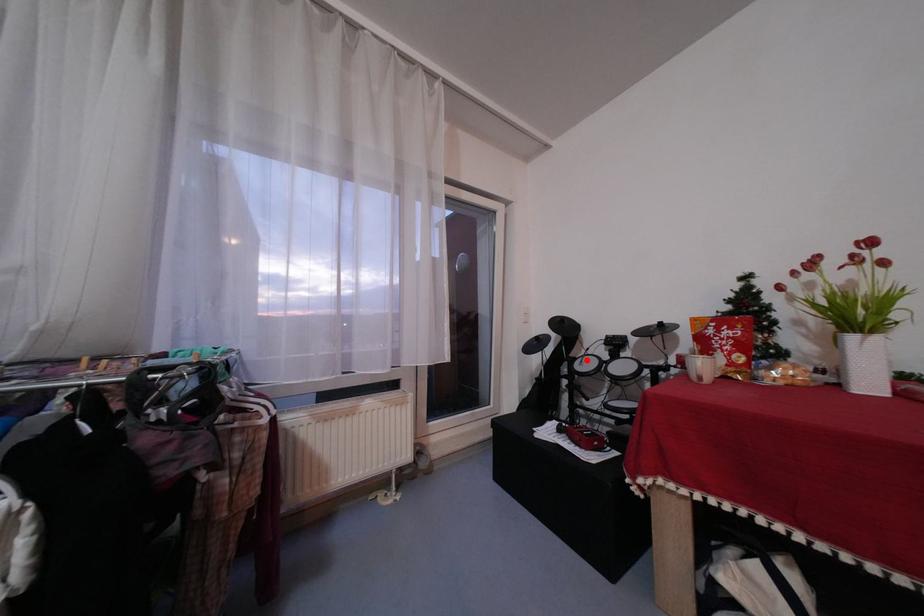
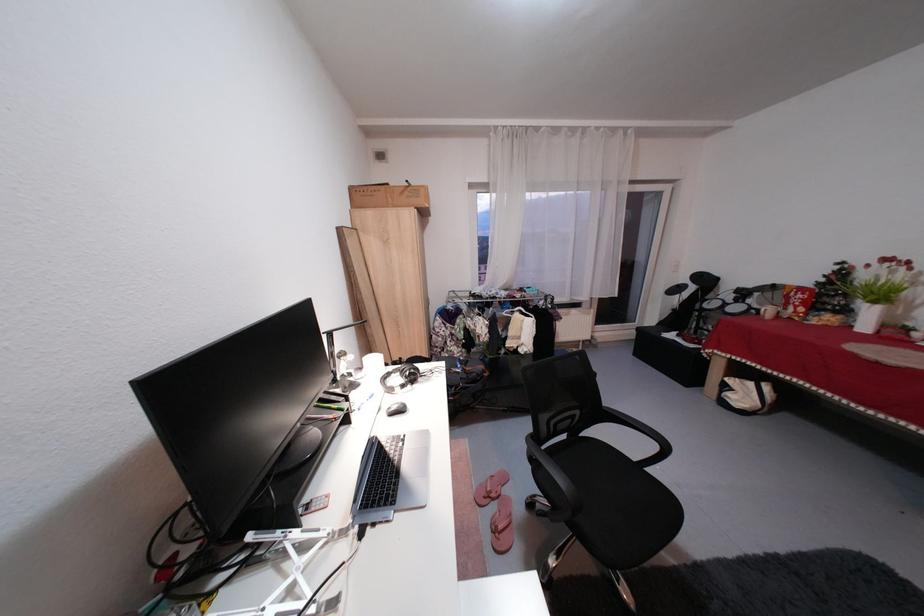
The point at the highlighted location is marked in the first image. Where is the corresponding point in the second image?

(719, 302)